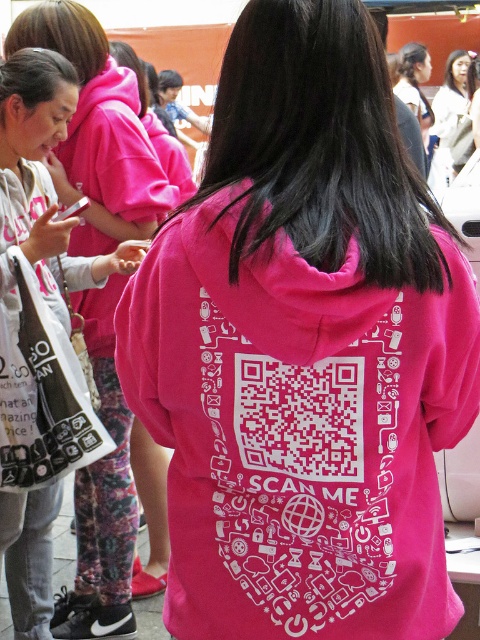
Question: Is pink matte hoodie at upper center to the right of white cotton blouse at upper center from the viewer's perspective?

Choices:
 (A) yes
 (B) no

Answer: (B)

Question: Does pink matte hoodie at upper center have a greater width compared to white cotton blouse at upper center?

Choices:
 (A) no
 (B) yes

Answer: (A)

Question: Which point is closer to the camera?

Choices:
 (A) (55, 288)
 (B) (435, 134)

Answer: (A)

Question: Does pink matte hoodie at upper center come in front of white cotton blouse at upper center?

Choices:
 (A) no
 (B) yes

Answer: (B)

Question: Among these objects, which one is nearest to the camera?

Choices:
 (A) white cotton blouse at upper center
 (B) pink matte hoodie at upper center

Answer: (B)

Question: Which point is farther to the camera?

Choices:
 (A) (460, 93)
 (B) (16, 548)

Answer: (A)